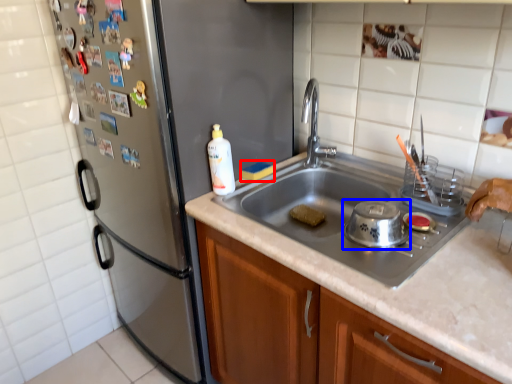
Question: Which object appears closest to the camera in this image, food (highlighted by a red box) or appliance (highlighted by a blue box)?

Choices:
 (A) food
 (B) appliance

Answer: (B)